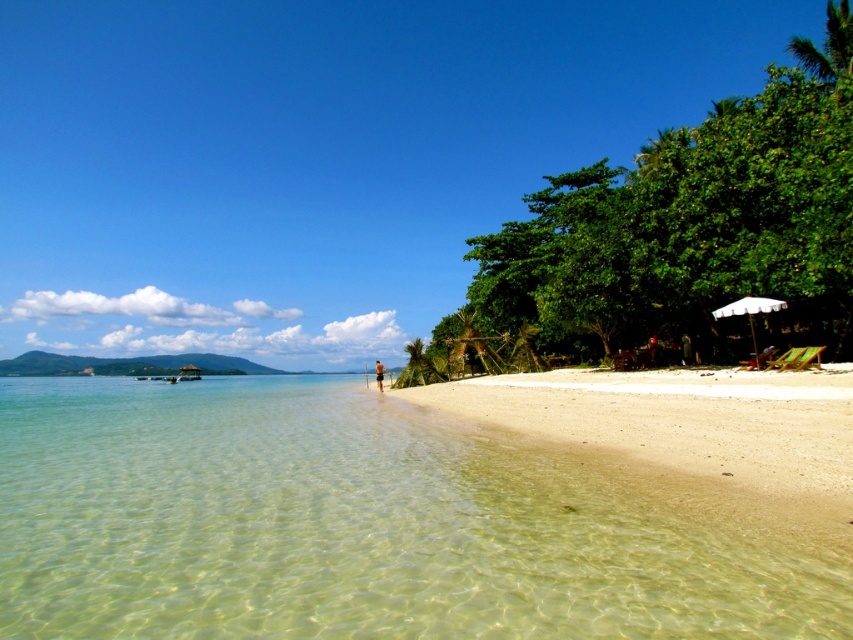
Which is more to the left, white striped umbrella at right or brown textured shorts at center?

From the viewer's perspective, brown textured shorts at center appears more on the left side.

Does white striped umbrella at right have a lesser width compared to brown textured shorts at center?

Yes.

Does point (746, 305) come behind point (375, 360)?

No, it is in front of (375, 360).

At what (x,y) coordinates should I click in order to perform the action: click on white striped umbrella at right. Please return your answer as a coordinate pair (x, y). Image resolution: width=853 pixels, height=640 pixels. Looking at the image, I should click on (749, 314).

Can you confirm if clear water at lower left is positioned below brown textured shorts at center?

No, clear water at lower left is not below brown textured shorts at center.

Locate an element on the screen. This screenshot has width=853, height=640. clear water at lower left is located at coordinates (363, 525).

Identify the location of clear water at lower left. The height and width of the screenshot is (640, 853). (363, 525).

Which is more to the right, clear water at lower left or white striped umbrella at right?

white striped umbrella at right is more to the right.

Can you confirm if clear water at lower left is taller than white striped umbrella at right?

Yes.

The image size is (853, 640). I want to click on clear water at lower left, so click(x=363, y=525).